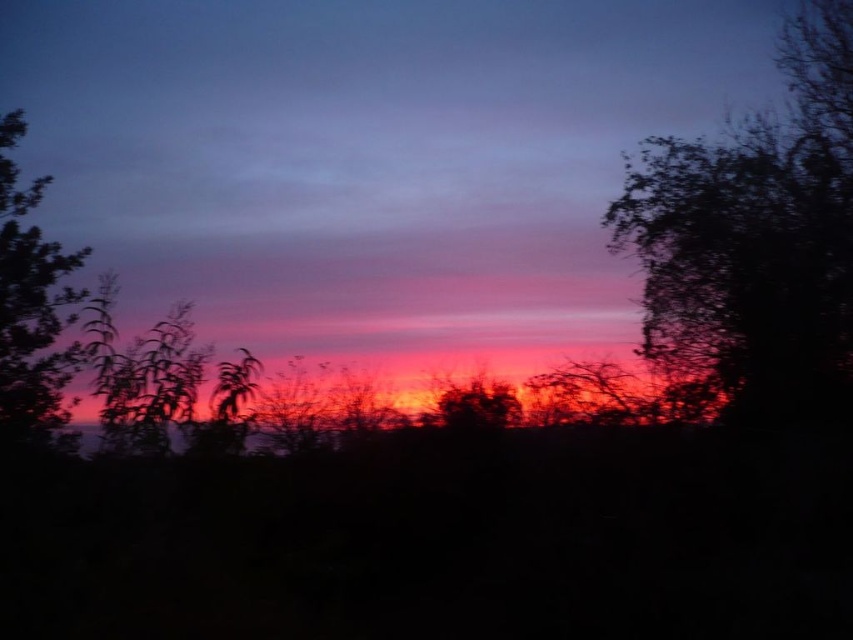
Question: Does silhouette leafy tree at right appear under silky purple leaves at left?

Choices:
 (A) yes
 (B) no

Answer: (B)

Question: Which point appears closest to the camera in this image?

Choices:
 (A) (42, 282)
 (B) (821, 45)

Answer: (A)

Question: Is silhouette leafy tree at right smaller than silky purple leaves at left?

Choices:
 (A) no
 (B) yes

Answer: (B)

Question: Does silhouette leafy tree at right have a smaller size compared to silky purple leaves at left?

Choices:
 (A) no
 (B) yes

Answer: (B)